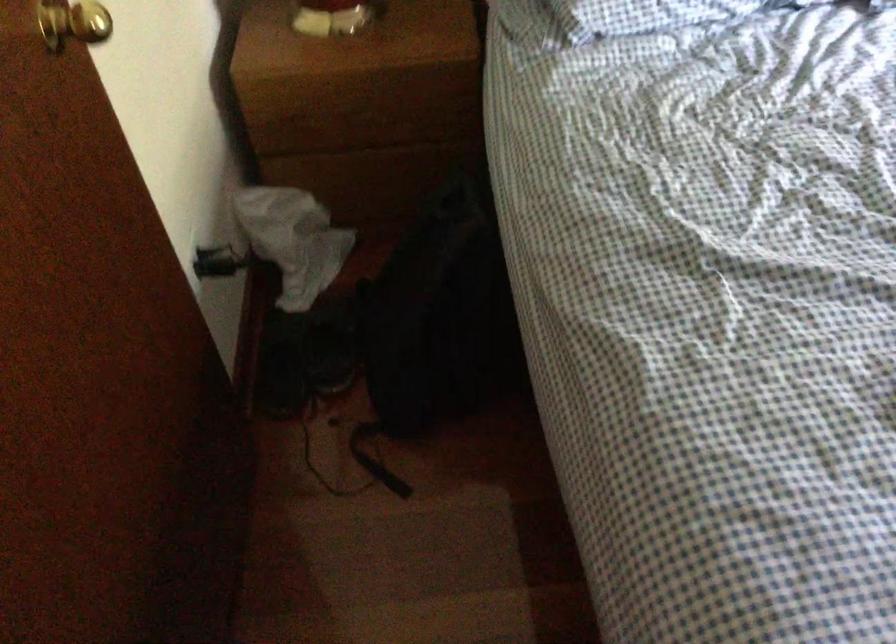
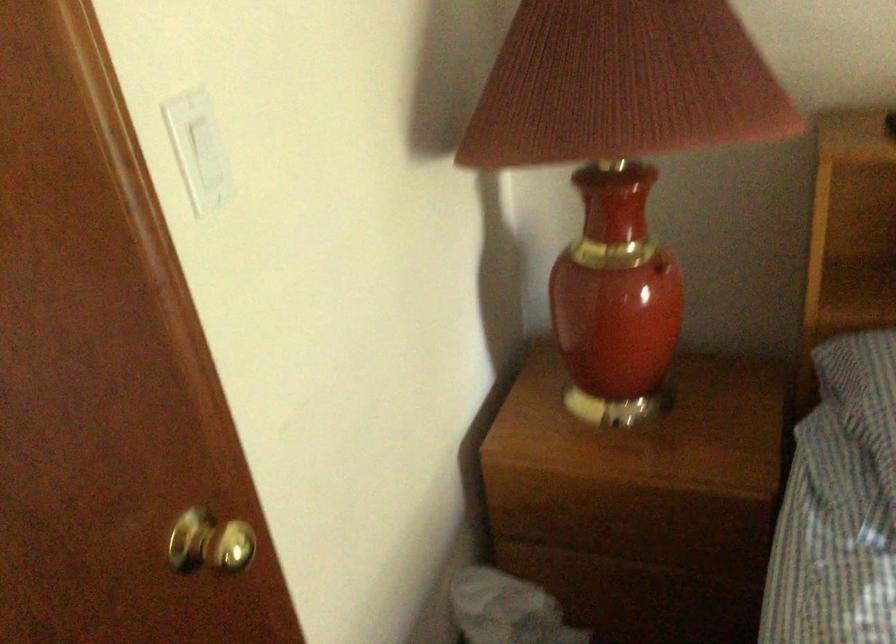
Question: In a continuous first-person perspective shot, in which direction is the camera moving?

Choices:
 (A) Left
 (B) Right
 (C) Forward
 (D) Backward

Answer: (C)